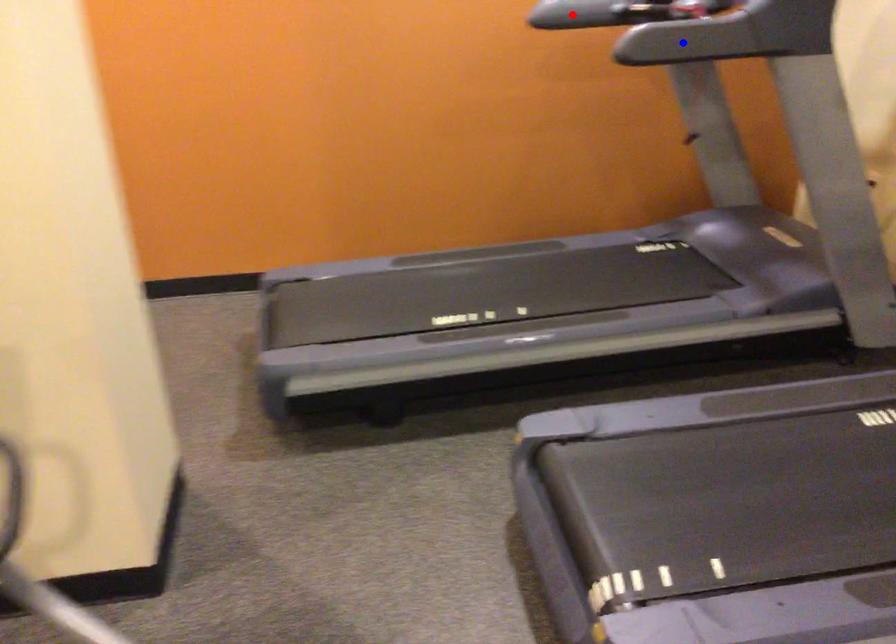
Question: In the image, two points are highlighted. Which point is nearer to the camera? Reply with the corresponding letter.

Choices:
 (A) blue point
 (B) red point

Answer: (A)